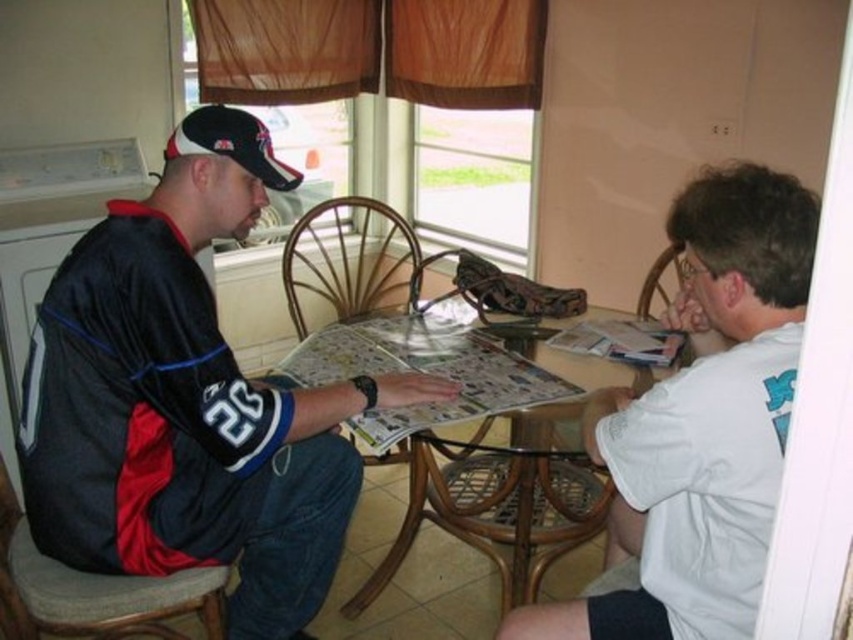
You are a tailor who needs to determine which item requires more fabric to repair between the black jersey at center and the black fabric baseball cap at upper left. Which one would need more fabric?

The black jersey at center requires more fabric for repair since it is larger in size than the black fabric baseball cap at upper left.

You are standing in front of the table and want to place a small object on the table. Which point, point (38, 321) or point (193, 141), is closer to you?

Point (38, 321) is closer to the viewer than point (193, 141), so you should place the object there if you want it nearer to you.